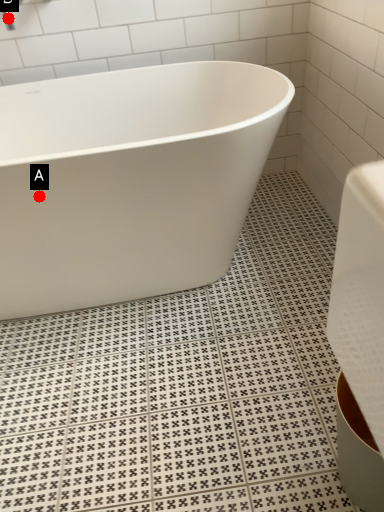
Question: Two points are circled on the image, labeled by A and B beside each circle. Which point is closer to the camera?

Choices:
 (A) A is closer
 (B) B is closer

Answer: (A)